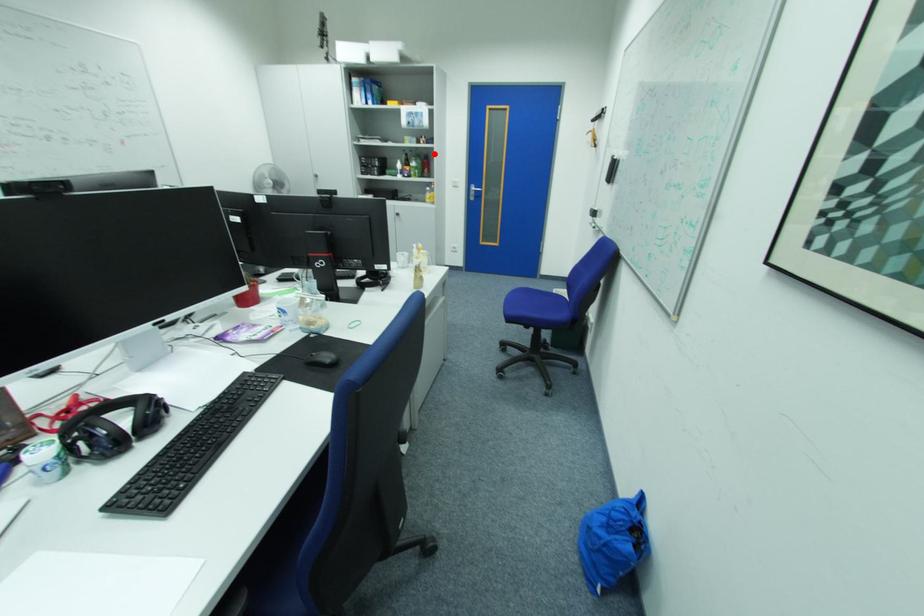
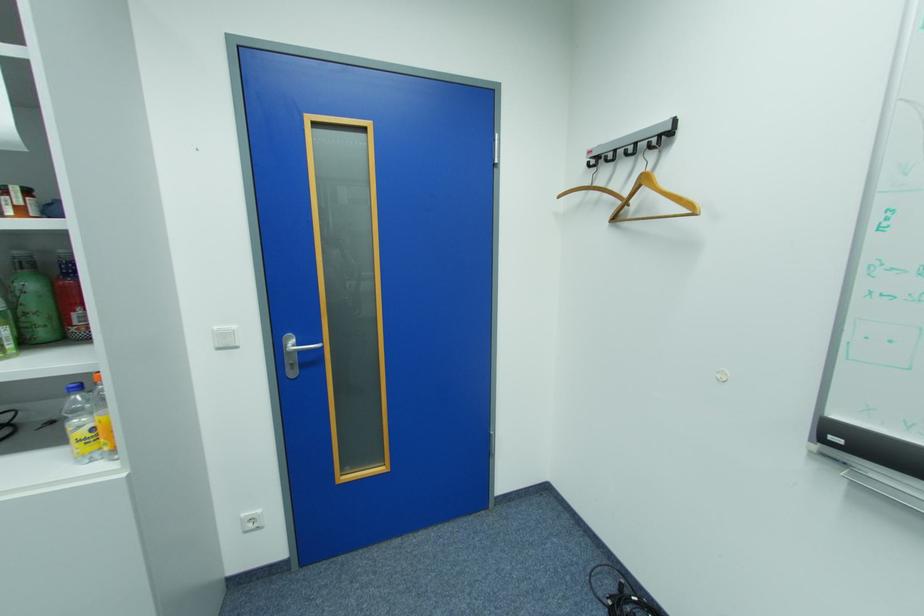
Question: A red point is marked in image1. In image2, is the corresponding 3D point closer to the camera or farther? Reply with the corresponding letter.

Choices:
 (A) The corresponding 3D point is closer.
 (B) The corresponding 3D point is farther.

Answer: (B)